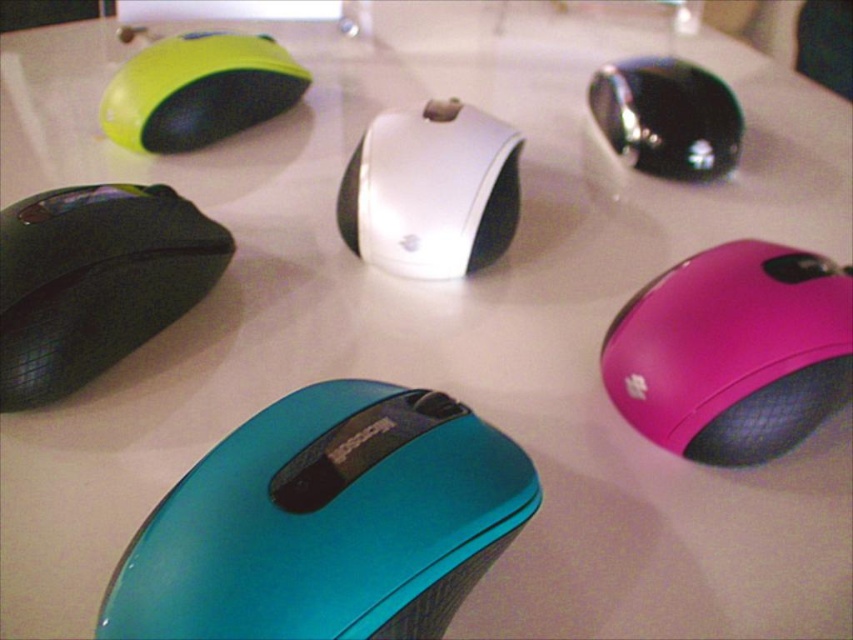
Question: Does green rubberized mouse at upper left lie behind glossy black mouse at upper right?

Choices:
 (A) yes
 (B) no

Answer: (B)

Question: Which is nearer to the white glossy mouse at center?

Choices:
 (A) matte black mouse at left
 (B) green rubberized mouse at upper left
 (C) teal glossy mouse at lower center

Answer: (B)

Question: Does pink glossy mouse at lower right appear over green rubberized mouse at upper left?

Choices:
 (A) yes
 (B) no

Answer: (B)

Question: Considering the real-world distances, which object is closest to the matte black mouse at left?

Choices:
 (A) pink glossy mouse at lower right
 (B) green rubberized mouse at upper left
 (C) teal glossy mouse at lower center

Answer: (B)

Question: Which point appears closest to the camera in this image?

Choices:
 (A) (763, 412)
 (B) (186, 72)
 (C) (607, 72)
 (D) (224, 586)

Answer: (D)

Question: Does white glossy mouse at center appear under green rubberized mouse at upper left?

Choices:
 (A) no
 (B) yes

Answer: (B)